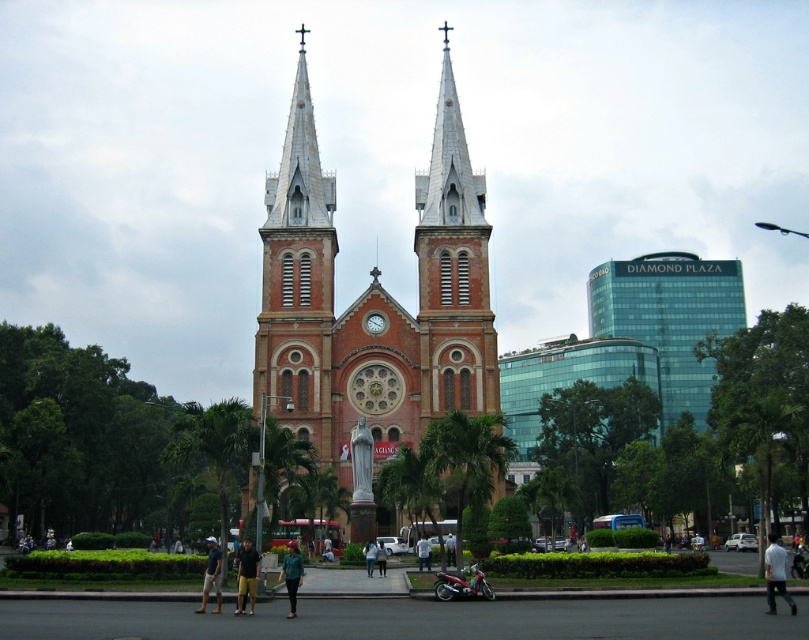
From the picture: You are a photographer standing in front of the church and want to capture both the white cotton shirt at lower right and the green fabric dress at center in a single frame. Which clothing item will appear closer to the bottom of the photo?

The white cotton shirt at lower right will appear closer to the bottom of the photo because it is positioned under the green fabric dress at center.

Consider the image. You are standing in the church courtyard and see a person wearing a white cotton shirt at lower right and yellow shorts at center. Which clothing item is positioned more to the east?

The white cotton shirt at lower right is positioned more to the east because it is to the right of the yellow shorts at center, and in the image, east would be the direction corresponding to the right side from the observer.